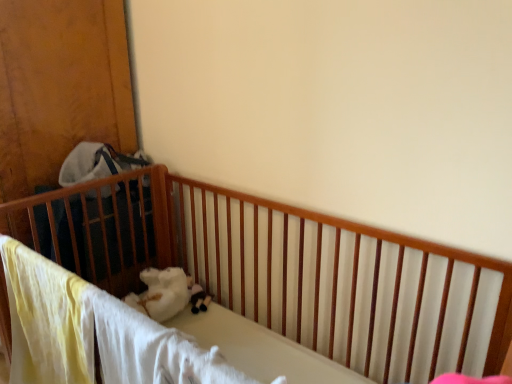
What do you see at coordinates (198, 296) in the screenshot? I see `soft plush toy at center` at bounding box center [198, 296].

Locate an element on the screen. soft plush toy at center is located at coordinates (198, 296).

Locate an element on the screen. wooden crib at left is located at coordinates (104, 227).

Measure the distance between point (x=75, y=268) and camera.

The depth of point (x=75, y=268) is 1.58 meters.

Describe the element at coordinates (104, 227) in the screenshot. I see `wooden crib at left` at that location.

In the scene shown: In order to face wooden crib at left, should I rotate leftwards or rightwards?

Rotate left and turn 19.832 degrees.

This screenshot has height=384, width=512. In order to click on soft plush toy at center in this screenshot , I will do `click(198, 296)`.

Which is more to the right, wooden crib at left or soft plush toy at center?

From the viewer's perspective, soft plush toy at center appears more on the right side.

Is the depth of wooden crib at left greater than that of soft plush toy at center?

No, wooden crib at left is in front of soft plush toy at center.

Is point (129, 174) less distant than point (199, 308)?

Yes, point (129, 174) is in front of point (199, 308).

From the image's perspective, does wooden crib at left appear higher than soft plush toy at center?

Indeed, from the image's perspective, wooden crib at left is shown above soft plush toy at center.

From a real-world perspective, which object stands above the other?

wooden crib at left.

Can you confirm if wooden crib at left is thinner than soft plush toy at center?

No, wooden crib at left is not thinner than soft plush toy at center.

Is wooden crib at left shorter than soft plush toy at center?

No, wooden crib at left is not shorter than soft plush toy at center.

In terms of size, does wooden crib at left appear bigger or smaller than soft plush toy at center?

In the image, wooden crib at left appears to be larger than soft plush toy at center.

Is soft plush toy at center surrounded by wooden crib at left?

No, soft plush toy at center is not surrounded by wooden crib at left.

Is wooden crib at left beside soft plush toy at center?

No, wooden crib at left is not making contact with soft plush toy at center.

Is wooden crib at left aimed at soft plush toy at center?

No, wooden crib at left is not aimed at soft plush toy at center.

What's the angular difference between wooden crib at left and soft plush toy at center's facing directions?

28.2 degrees.

Find the location of a particular element. infant bed in front of the soft plush toy at center is located at coordinates (104, 227).

Can you confirm if soft plush toy at center is positioned to the right of wooden crib at left?

Correct, you'll find soft plush toy at center to the right of wooden crib at left.

Based on the photo, which is in front, soft plush toy at center or wooden crib at left?

wooden crib at left is in front.

Is point (204, 298) farther from viewer compared to point (25, 209)?

Yes, point (204, 298) is farther from viewer.

From the image's perspective, is soft plush toy at center over wooden crib at left?

No, from the image's perspective, soft plush toy at center is not over wooden crib at left.

From a real-world perspective, who is located higher, soft plush toy at center or wooden crib at left?

In real-world perspective, wooden crib at left is above.

Considering the relative sizes of soft plush toy at center and wooden crib at left in the image provided, is soft plush toy at center wider than wooden crib at left?

Incorrect, the width of soft plush toy at center does not surpass that of wooden crib at left.

From the picture: Which of these two, soft plush toy at center or wooden crib at left, stands taller?

With more height is wooden crib at left.

Considering the sizes of soft plush toy at center and wooden crib at left in the image, is soft plush toy at center bigger or smaller than wooden crib at left?

Clearly, soft plush toy at center is smaller in size than wooden crib at left.

Is soft plush toy at center not within wooden crib at left?

Indeed, soft plush toy at center is completely outside wooden crib at left.

Are soft plush toy at center and wooden crib at left making contact?

No.

Is soft plush toy at center aimed at wooden crib at left?

No, soft plush toy at center is not oriented towards wooden crib at left.

What's the angular difference between soft plush toy at center and wooden crib at left's facing directions?

There is a 28.2-degree angle between the facing directions of soft plush toy at center and wooden crib at left.

At what (x,y) coordinates should I click in order to perform the action: click on toy below the wooden crib at left (from the image's perspective). Please return your answer as a coordinate pair (x, y). Looking at the image, I should click on (198, 296).

Identify the location of infant bed above the soft plush toy at center (from a real-world perspective). (104, 227).

At what (x,y) coordinates should I click in order to perform the action: click on infant bed lying on the left of soft plush toy at center. Please return your answer as a coordinate pair (x, y). The width and height of the screenshot is (512, 384). Looking at the image, I should click on (104, 227).